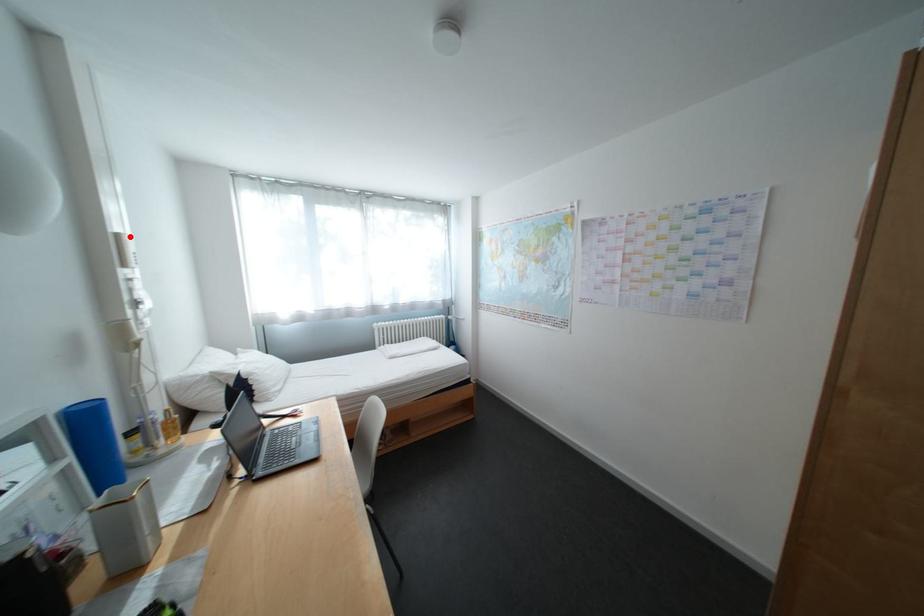
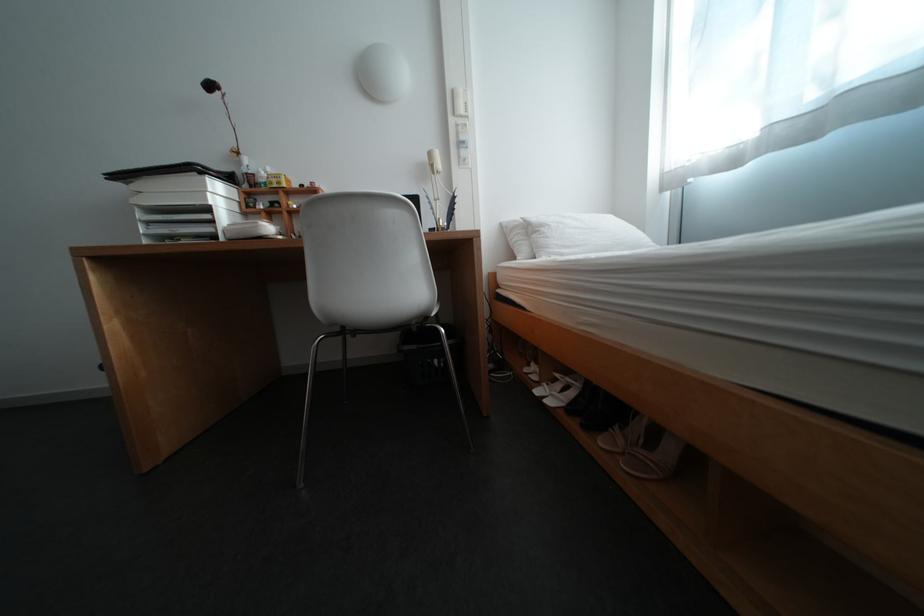
Question: I am providing you with two images of the same scene from different viewpoints. Image1 has a red point marked. In image2, the corresponding 3D location appears at what relative position? Reply with the corresponding letter.

Choices:
 (A) Closer
 (B) Farther

Answer: (A)